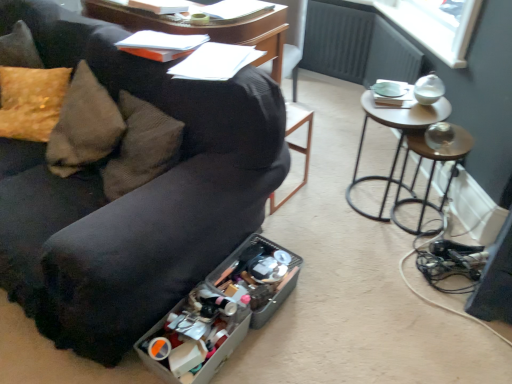
In order to face translucent plastic container at lower center, positioned as the second storage box in front-to-back order, should I rotate leftwards or rightwards?

Turn right approximately 0.070 degrees to face it.

What is the approximate height of translucent plastic container at lower center, the first storage box viewed from the back?

5.78 inches.

You are a GUI agent. You are given a task and a screenshot of the screen. Output one action in this format:
    pyautogui.click(x=<x>, y=<y>)
    Task: Click on the metallic silver table at right
    The width and height of the screenshot is (512, 384).
    Given the screenshot: What is the action you would take?
    pyautogui.click(x=399, y=138)

Image resolution: width=512 pixels, height=384 pixels. What do you see at coordinates (223, 352) in the screenshot? I see `translucent plastic storage box at lower center, the first storage box positioned from the front` at bounding box center [223, 352].

Find the location of `translucent plastic storage box at lower center, the first storage box positioned from the front`. translucent plastic storage box at lower center, the first storage box positioned from the front is located at coordinates (223, 352).

In order to click on black leather bar stool at center in this screenshot , I will do `click(295, 144)`.

Considering the relative sizes of black leather bar stool at center and metallic silver table at right in the image provided, is black leather bar stool at center smaller than metallic silver table at right?

Indeed, black leather bar stool at center has a smaller size compared to metallic silver table at right.

Considering the positions of objects black leather bar stool at center and metallic silver table at right in the image provided, who is more to the left, black leather bar stool at center or metallic silver table at right?

black leather bar stool at center.

Can you tell me how much black leather bar stool at center and metallic silver table at right differ in facing direction?

There is a 179-degree angle between the facing directions of black leather bar stool at center and metallic silver table at right.

Considering the relative sizes of black leather bar stool at center and metallic silver table at right in the image provided, is black leather bar stool at center shorter than metallic silver table at right?

Yes.

Which is in front, metallic brown stool at right or metallic silver table at right?

Positioned in front is metallic silver table at right.

From a real-world perspective, which object stands above the other?

In real-world perspective, metallic silver table at right is above.

Measure the distance from metallic brown stool at right to metallic silver table at right.

A distance of 27.65 centimeters exists between metallic brown stool at right and metallic silver table at right.

Is metallic brown stool at right not inside metallic silver table at right?

Yes.

This screenshot has height=384, width=512. I want to click on bar stool above the translucent plastic storage box at lower center, the first storage box positioned from the front (from the image's perspective), so click(295, 144).

Can you confirm if translucent plastic storage box at lower center, the first storage box positioned from the front, is smaller than black leather bar stool at center?

Correct, translucent plastic storage box at lower center, the first storage box positioned from the front, occupies less space than black leather bar stool at center.

Which object is wider, translucent plastic storage box at lower center, the first storage box positioned from the front, or black leather bar stool at center?

Wider between the two is black leather bar stool at center.

Can you tell me how much translucent plastic storage box at lower center, the first storage box positioned from the front, and black leather bar stool at center differ in facing direction?

There is a 88.2-degree angle between the facing directions of translucent plastic storage box at lower center, the first storage box positioned from the front, and black leather bar stool at center.

In the scene shown: Is translucent plastic container at lower center, positioned as the second storage box in front-to-back order, not near black leather bar stool at center?

Actually, translucent plastic container at lower center, positioned as the second storage box in front-to-back order, and black leather bar stool at center are a little close together.

Could you measure the distance between translucent plastic container at lower center, the first storage box viewed from the back, and black leather bar stool at center?

They are 20.34 inches apart.

Is translucent plastic container at lower center, the first storage box viewed from the back, completely or partially outside of black leather bar stool at center?

Indeed, translucent plastic container at lower center, the first storage box viewed from the back, is completely outside black leather bar stool at center.

Is point (264, 239) positioned in front of point (309, 127)?

Yes, point (264, 239) is closer to viewer.

From the picture: Considering the sizes of objects black leather bar stool at center and metallic brown stool at right in the image provided, who is shorter, black leather bar stool at center or metallic brown stool at right?

With less height is metallic brown stool at right.

Looking at their sizes, would you say black leather bar stool at center is wider or thinner than metallic brown stool at right?

In the image, black leather bar stool at center appears to be wider than metallic brown stool at right.

Considering their positions, is black leather bar stool at center located in front of or behind metallic brown stool at right?

black leather bar stool at center is positioned closer to the viewer than metallic brown stool at right.

Would you say black leather bar stool at center is to the left or to the right of metallic brown stool at right in the picture?

Clearly, black leather bar stool at center is on the left of metallic brown stool at right in the image.

In the scene shown: Considering the sizes of metallic silver table at right and black leather bar stool at center in the image, is metallic silver table at right bigger or smaller than black leather bar stool at center?

Clearly, metallic silver table at right is larger in size than black leather bar stool at center.

How different are the orientations of metallic silver table at right and black leather bar stool at center in degrees?

There is a 179-degree angle between the facing directions of metallic silver table at right and black leather bar stool at center.

Is metallic silver table at right oriented towards black leather bar stool at center?

No, metallic silver table at right is not oriented towards black leather bar stool at center.

Which of these two, metallic silver table at right or black fabric couch at lower left, is bigger?

Bigger between the two is black fabric couch at lower left.

Looking at this image, could you tell me if metallic silver table at right is turned towards black fabric couch at lower left?

No, metallic silver table at right is not turned towards black fabric couch at lower left.

Is metallic silver table at right spatially inside black fabric couch at lower left, or outside of it?

metallic silver table at right is outside black fabric couch at lower left.

I want to click on bar stool behind the metallic silver table at right, so click(295, 144).

Locate an element on the screen. This screenshot has width=512, height=384. side table on the right of metallic silver table at right is located at coordinates (432, 166).

Considering their positions, is metallic silver table at right positioned closer to black leather bar stool at center than translucent plastic container at lower center, the first storage box viewed from the back?

Among the two, metallic silver table at right is located nearer to black leather bar stool at center.

Looking at the image, which one is located further to black leather bar stool at center, black fabric couch at lower left or translucent plastic container at lower center, the first storage box viewed from the back?

The object further to black leather bar stool at center is black fabric couch at lower left.

Looking at the image, which one is located closer to metallic brown stool at right, translucent plastic storage box at lower center, the first storage box positioned from the front, or translucent plastic container at lower center, positioned as the second storage box in front-to-back order?

translucent plastic container at lower center, positioned as the second storage box in front-to-back order, is closer to metallic brown stool at right.

Which object lies further to the anchor point black fabric couch at lower left, translucent plastic storage box at lower center, arranged as the second storage box when viewed from the back, or metallic brown stool at right?

Among the two, metallic brown stool at right is located further to black fabric couch at lower left.

Based on their spatial positions, is metallic silver table at right or translucent plastic storage box at lower center, the first storage box positioned from the front, closer to black fabric couch at lower left?

The object closer to black fabric couch at lower left is translucent plastic storage box at lower center, the first storage box positioned from the front.

When comparing their distances from black fabric couch at lower left, does translucent plastic storage box at lower center, arranged as the second storage box when viewed from the back, or translucent plastic container at lower center, positioned as the second storage box in front-to-back order, seem further?

Among the two, translucent plastic storage box at lower center, arranged as the second storage box when viewed from the back, is located further to black fabric couch at lower left.

From the image, which object appears to be nearer to translucent plastic storage box at lower center, arranged as the second storage box when viewed from the back, black fabric couch at lower left or black leather bar stool at center?

The object closer to translucent plastic storage box at lower center, arranged as the second storage box when viewed from the back, is black fabric couch at lower left.

Estimate the real-world distances between objects in this image. Which object is closer to metallic brown stool at right, translucent plastic container at lower center, positioned as the second storage box in front-to-back order, or metallic silver table at right?

metallic silver table at right lies closer to metallic brown stool at right than the other object.

Where is `bar stool situated between translucent plastic storage box at lower center, the first storage box positioned from the front, and metallic silver table at right from left to right`? The image size is (512, 384). bar stool situated between translucent plastic storage box at lower center, the first storage box positioned from the front, and metallic silver table at right from left to right is located at coordinates (295, 144).

Where is `bar stool situated between black fabric couch at lower left and metallic silver table at right from left to right`? This screenshot has height=384, width=512. bar stool situated between black fabric couch at lower left and metallic silver table at right from left to right is located at coordinates (295, 144).

Identify the location of table between black leather bar stool at center and metallic brown stool at right in the horizontal direction. (399, 138).

The image size is (512, 384). Find the location of `bar stool between translucent plastic container at lower center, the first storage box viewed from the back, and metallic brown stool at right`. bar stool between translucent plastic container at lower center, the first storage box viewed from the back, and metallic brown stool at right is located at coordinates (295, 144).